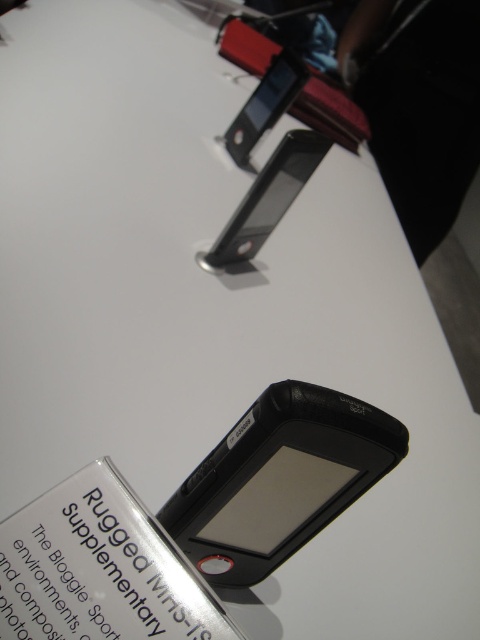
Question: Is the position of black matte gps at center more distant than that of black matte smartphone at upper center?

Choices:
 (A) no
 (B) yes

Answer: (A)

Question: Based on their relative distances, which object is nearer to the black matte gps at center?

Choices:
 (A) matte black phone at upper center
 (B) black matte smartphone at upper center

Answer: (B)

Question: Is black matte smartphone at upper center closer to the viewer compared to matte black phone at upper center?

Choices:
 (A) no
 (B) yes

Answer: (B)

Question: Is black matte smartphone at upper center to the left of matte black phone at upper center from the viewer's perspective?

Choices:
 (A) yes
 (B) no

Answer: (A)

Question: Among these points, which one is farthest from the camera?

Choices:
 (A) (289, 70)
 (B) (290, 152)

Answer: (A)

Question: Which object is the farthest from the black matte smartphone at upper center?

Choices:
 (A) matte black phone at upper center
 (B) black matte gps at center

Answer: (B)